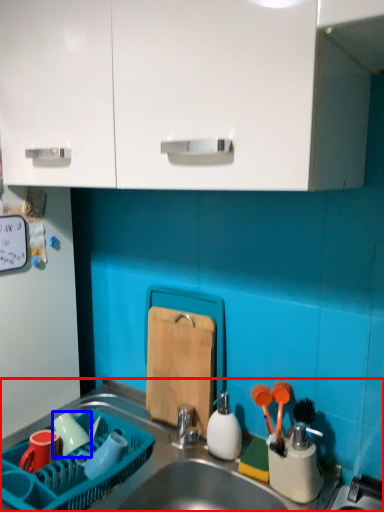
Question: Among these objects, which one is farthest to the camera, sink (highlighted by a red box) or tableware (highlighted by a blue box)?

Choices:
 (A) sink
 (B) tableware

Answer: (B)